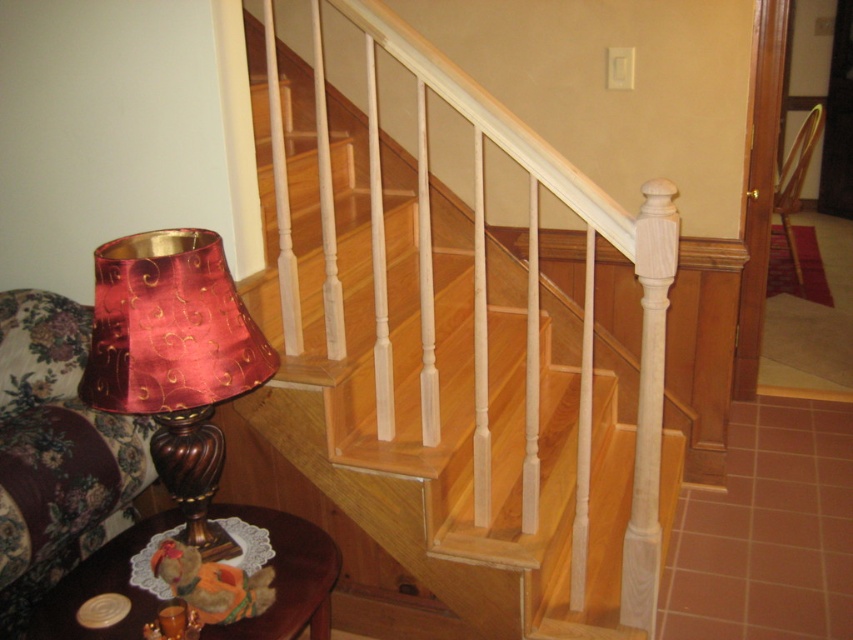
Question: Which point is closer to the camera?

Choices:
 (A) floral fabric armchair at left
 (B) brown wooden stool at lower left

Answer: (B)

Question: Which object is positioned closest to the brown wooden stool at lower left?

Choices:
 (A) floral fabric armchair at left
 (B) natural wood stairs at upper center
 (C) satin burgundy lampshade at left
 (D) wooden armchair at center

Answer: (A)

Question: In this image, where is floral fabric armchair at left located relative to brown wooden stool at lower left?

Choices:
 (A) left
 (B) right

Answer: (A)

Question: Which of the following is the farthest from the observer?

Choices:
 (A) (169, 486)
 (B) (91, 440)
 (C) (672, 483)

Answer: (C)

Question: Is natural wood stairs at upper center above brown wooden stool at lower left?

Choices:
 (A) no
 (B) yes

Answer: (B)

Question: In this image, where is natural wood stairs at upper center located relative to wooden armchair at center?

Choices:
 (A) below
 (B) above

Answer: (A)